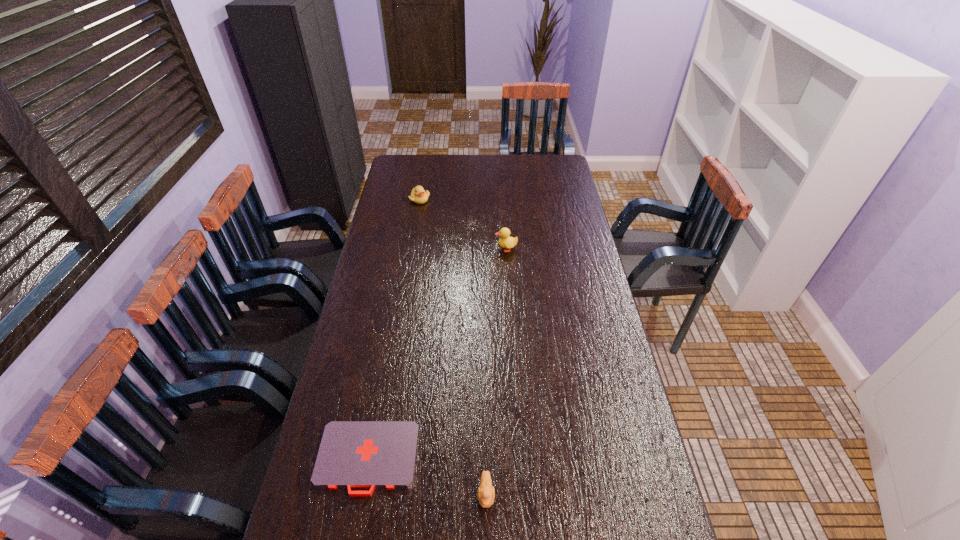
Select which duckling is the closest to the third object from left to right. Please provide its 2D coordinates. Your answer should be formatted as a tuple, i.e. [(x, y)], where the tuple contains the x and y coordinates of a point satisfying the conditions above.

[(505, 241)]

Locate which duckling is the third closest to the first-aid kit. Please provide its 2D coordinates. Your answer should be formatted as a tuple, i.e. [(x, y)], where the tuple contains the x and y coordinates of a point satisfying the conditions above.

[(418, 195)]

This screenshot has width=960, height=540. In order to click on free space that satisfies the following two spatial constraints: 1. on the front-facing side of the second farthest duckling; 2. on handle side the first-aid kit in this screenshot , I will do coord(519,458).